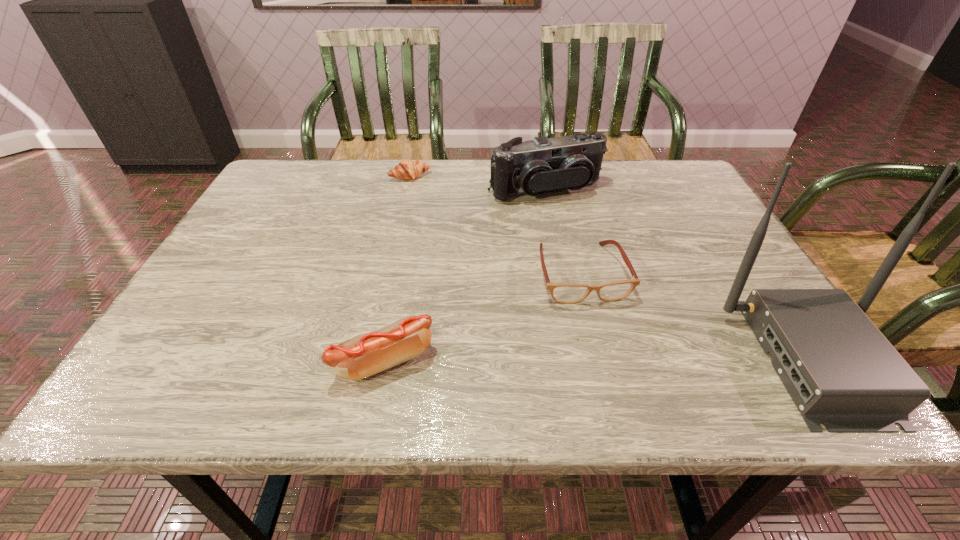
The height and width of the screenshot is (540, 960). I want to click on sausage, so click(362, 356).

Where is `the tallest object`? This screenshot has width=960, height=540. the tallest object is located at coordinates (840, 370).

Where is `router`? router is located at coordinates (840, 370).

What are the coordinates of `camcorder` in the screenshot? It's located at (542, 165).

You are a GUI agent. You are given a task and a screenshot of the screen. Output one action in this format:
    pyautogui.click(x=<x>, y=<y>)
    Task: Click on the second shortest object
    The height and width of the screenshot is (540, 960).
    Given the screenshot: What is the action you would take?
    pyautogui.click(x=563, y=293)

You are a GUI agent. You are given a task and a screenshot of the screen. Output one action in this format:
    pyautogui.click(x=<x>, y=<y>)
    Task: Click on the pastry
    Image resolution: width=960 pixels, height=540 pixels.
    Given the screenshot: What is the action you would take?
    pyautogui.click(x=407, y=169)

The width and height of the screenshot is (960, 540). What are the coordinates of `free region located on the right of the sausage` in the screenshot? It's located at (482, 361).

Where is `free location located 0.070m on the front-facing side of the fourth shortest object`? Image resolution: width=960 pixels, height=540 pixels. free location located 0.070m on the front-facing side of the fourth shortest object is located at coordinates (574, 219).

I want to click on vacant space located on the front-facing side of the fourth shortest object, so click(x=610, y=270).

Locate an element on the screen. Image resolution: width=960 pixels, height=540 pixels. vacant space located 0.180m on the front-facing side of the fourth shortest object is located at coordinates (592, 246).